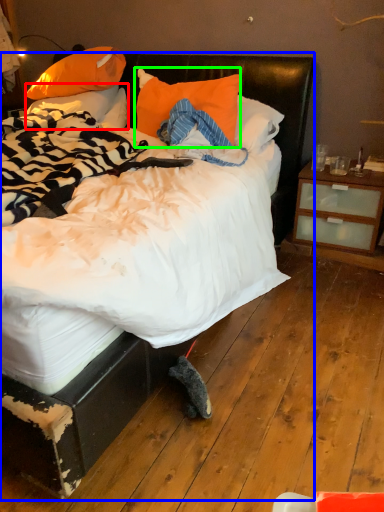
Question: Considering the real-world distances, which object is closest to pillow (highlighted by a red box)? bed (highlighted by a blue box) or pillow (highlighted by a green box).

Choices:
 (A) bed
 (B) pillow

Answer: (B)